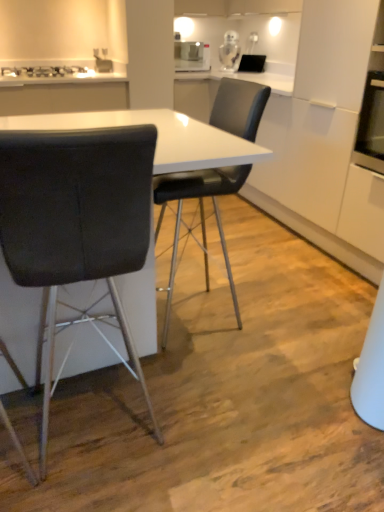
Locate an element on the screen. This screenshot has width=384, height=512. empty space that is in between black leather chair at center, which is the 1th chair from right to left, and white glossy table at center is located at coordinates (236, 332).